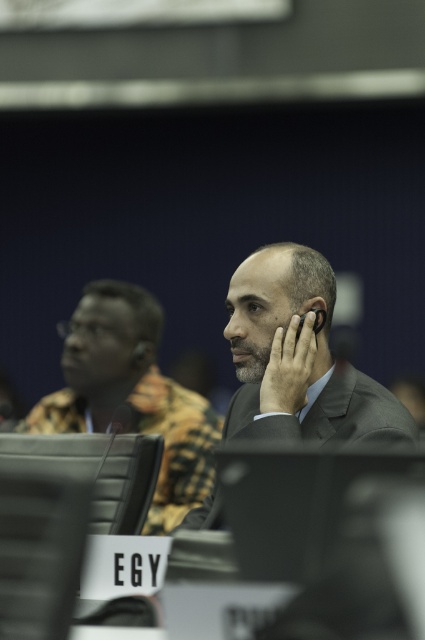
You are organizing a photo shoot and need to arrange two suits in the center of the frame. The matte gray suit at center and the matte black suit at center must be positioned so that the smaller one is in front. Which suit should be placed in front?

The matte gray suit at center should be placed in front because it has a smaller size compared to the matte black suit at center.

You are standing in the conference room and see two points marked in the scene. Which point is closer to you, point [286,376] or point [119,307]?

Point [286,376] is in front of point [119,307], so it is closer to you.